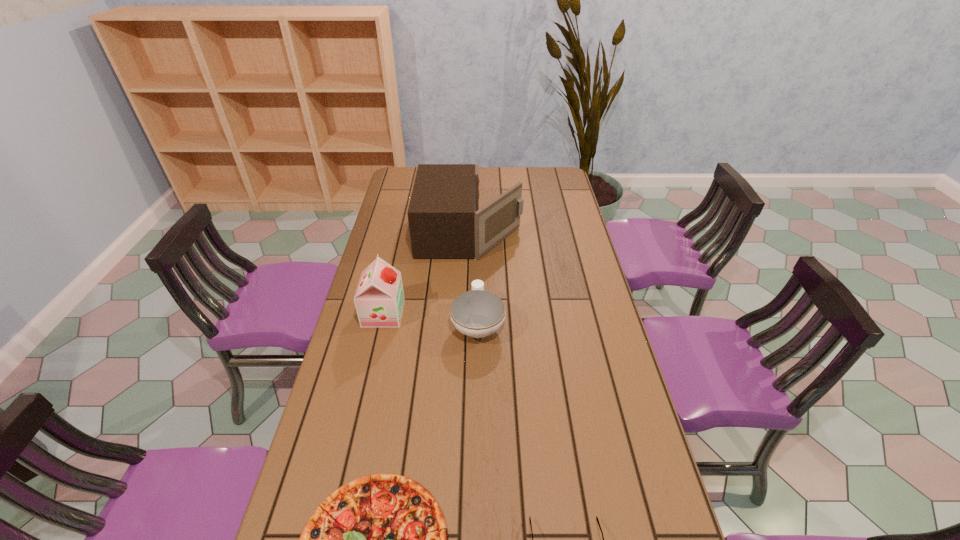
The height and width of the screenshot is (540, 960). I want to click on free space at the right edge of the desktop, so click(596, 418).

Image resolution: width=960 pixels, height=540 pixels. I want to click on vacant region at the far left corner, so click(x=394, y=181).

Find the location of a particular element. This screenshot has height=540, width=960. free space between the soya milk and the microwave oven is located at coordinates (426, 273).

I want to click on free space between the soya milk and the third tallest object, so click(x=431, y=319).

Image resolution: width=960 pixels, height=540 pixels. What are the coordinates of `vacant area that lies between the soya milk and the farthest object` in the screenshot? It's located at (426, 273).

This screenshot has height=540, width=960. I want to click on free space between the farthest object and the soya milk, so click(x=426, y=273).

Choose which object is the third nearest neighbor to the farthest object. Please provide its 2D coordinates. Your answer should be formatted as a tuple, i.e. [(x, y)], where the tuple contains the x and y coordinates of a point satisfying the conditions above.

[(381, 539)]

The image size is (960, 540). I want to click on the closest object to the spectacles, so click(381, 539).

This screenshot has width=960, height=540. Find the location of `free space that satisfies the following two spatial constraints: 1. with the door open on the front of the microwave oven; 2. on the side with the handle of the chinaware`. free space that satisfies the following two spatial constraints: 1. with the door open on the front of the microwave oven; 2. on the side with the handle of the chinaware is located at coordinates (468, 323).

Identify the location of blank space that satisfies the following two spatial constraints: 1. with the cap open on the soya milk; 2. on the side with the handle of the chinaware. (381, 323).